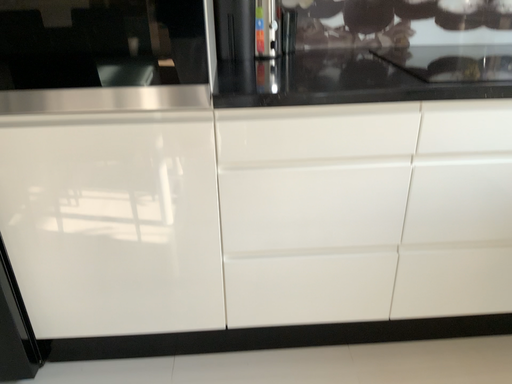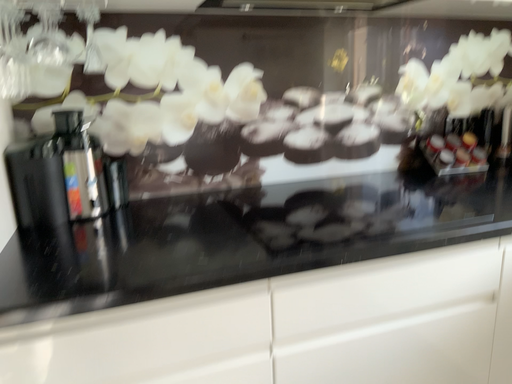
Question: Which way did the camera rotate in the video?

Choices:
 (A) rotated right
 (B) rotated left

Answer: (A)